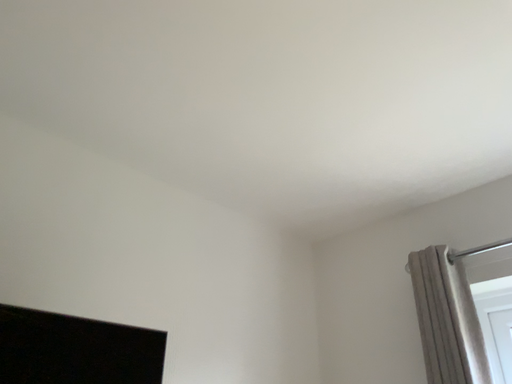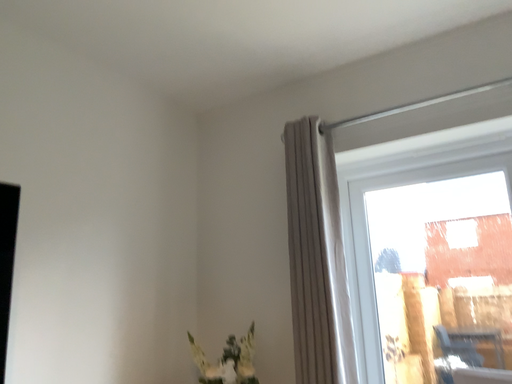
Question: How did the camera likely rotate when shooting the video?

Choices:
 (A) rotated downward
 (B) rotated upward

Answer: (A)